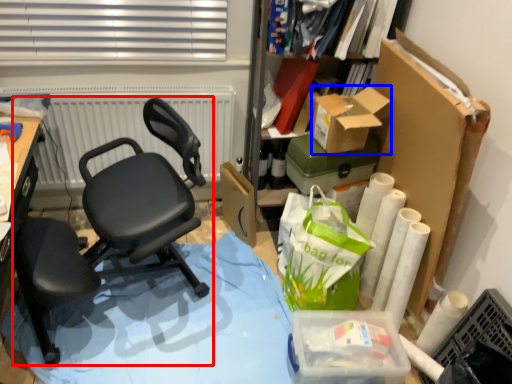
Question: Which object appears farthest to the camera in this image, chair (highlighted by a red box) or box (highlighted by a blue box)?

Choices:
 (A) chair
 (B) box

Answer: (B)